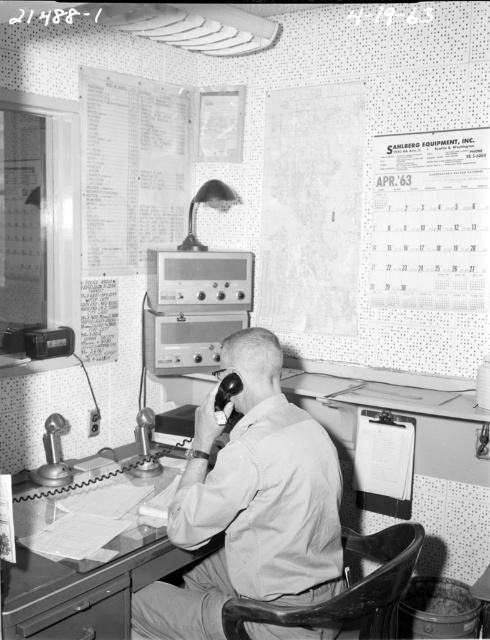
Looking at this image, can you confirm if paperboard sheet at upper left is thinner than leather-like chair at lower center?

Correct, paperboard sheet at upper left's width is less than leather-like chair at lower center's.

Does paperboard sheet at upper left appear over leather-like chair at lower center?

Yes.

Between point (131, 113) and point (380, 536), which one is positioned in front?

Point (380, 536) is more forward.

I want to click on paperboard sheet at upper left, so click(x=130, y=168).

Between point (167, 524) and point (361, 547), which one is positioned in front?

Point (167, 524) is in front.

Does light beige uniform at center have a greater width compared to leather-like chair at lower center?

Correct, the width of light beige uniform at center exceeds that of leather-like chair at lower center.

In order to click on light beige uniform at center in this screenshot , I will do `click(250, 504)`.

Can you confirm if light beige uniform at center is taller than smooth wooden desk at center?

Correct, light beige uniform at center is much taller as smooth wooden desk at center.

Does light beige uniform at center appear on the left side of smooth wooden desk at center?

No, light beige uniform at center is not to the left of smooth wooden desk at center.

Which is behind, point (270, 486) or point (213, 550)?

Point (213, 550)

This screenshot has height=640, width=490. I want to click on light beige uniform at center, so click(x=250, y=504).